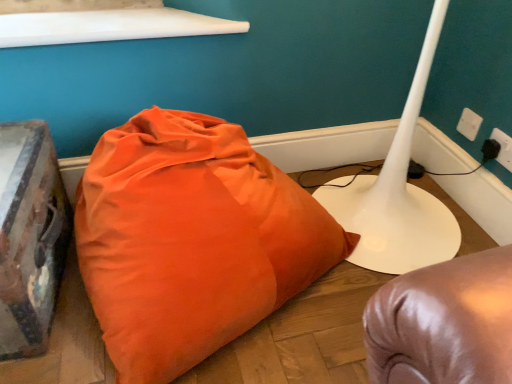
What do you see at coordinates (503, 148) in the screenshot? This screenshot has width=512, height=384. I see `white plastic electric outlet at upper right, the first electric outlet when ordered from right to left` at bounding box center [503, 148].

What do you see at coordinates (469, 124) in the screenshot? I see `white plastic electric outlet at upper right, the first electric outlet viewed from the left` at bounding box center [469, 124].

Locate an element on the screen. The width and height of the screenshot is (512, 384). white plastic electric outlet at upper right, acting as the 2th electric outlet starting from the top is located at coordinates (503, 148).

Is point (496, 157) more distant than point (425, 81)?

Yes, it is.

Can you see white plastic electric outlet at upper right, which is the 1th electric outlet in front-to-back order, touching white glossy table lamp at lower right?

No, white plastic electric outlet at upper right, which is the 1th electric outlet in front-to-back order, is not making contact with white glossy table lamp at lower right.

Considering the relative positions of white plastic electric outlet at upper right, the second electric outlet in the left-to-right sequence, and white glossy table lamp at lower right in the image provided, is white plastic electric outlet at upper right, the second electric outlet in the left-to-right sequence, to the left or to the right of white glossy table lamp at lower right?

white plastic electric outlet at upper right, the second electric outlet in the left-to-right sequence, is to the right of white glossy table lamp at lower right.

From a real-world perspective, is orange fabric pillow at center positioned above or below white glossy table lamp at lower right?

From a real-world perspective, orange fabric pillow at center is physically below white glossy table lamp at lower right.

From the image's perspective, is orange fabric pillow at center located above or below white glossy table lamp at lower right?

Clearly, from the image's perspective, orange fabric pillow at center is below white glossy table lamp at lower right.

Is orange fabric pillow at center taller or shorter than white glossy table lamp at lower right?

Considering their sizes, orange fabric pillow at center has less height than white glossy table lamp at lower right.

Is orange fabric pillow at center to the left of white glossy table lamp at lower right from the viewer's perspective?

Yes.

Considering the sizes of objects black plastic plug at lower right and white glossy table lamp at lower right in the image provided, who is smaller, black plastic plug at lower right or white glossy table lamp at lower right?

black plastic plug at lower right.

Is point (489, 150) behind point (430, 214)?

No, it is in front of (430, 214).

Is black plastic plug at lower right taller or shorter than white glossy table lamp at lower right?

Considering their sizes, black plastic plug at lower right has less height than white glossy table lamp at lower right.

Is white plastic electric outlet at upper right, the 1th electric outlet when ordered from back to front, bigger than white glossy table lamp at lower right?

No, white plastic electric outlet at upper right, the 1th electric outlet when ordered from back to front, is not bigger than white glossy table lamp at lower right.

In terms of height, does white plastic electric outlet at upper right, marked as the first electric outlet in a top-to-bottom arrangement, look taller or shorter compared to white glossy table lamp at lower right?

Clearly, white plastic electric outlet at upper right, marked as the first electric outlet in a top-to-bottom arrangement, is shorter compared to white glossy table lamp at lower right.

Which is closer, (470, 113) or (351, 259)?

Clearly, point (470, 113) is more distant from the camera than point (351, 259).

From a real-world perspective, is white plastic electric outlet at upper right, the 1th electric outlet when ordered from back to front, on white glossy table lamp at lower right?

Incorrect, from a real-world perspective, white plastic electric outlet at upper right, the 1th electric outlet when ordered from back to front, is lower than white glossy table lamp at lower right.

Which point is more forward, [398,130] or [150,244]?

The point [150,244] is closer.

From a real-world perspective, is white glossy table lamp at lower right located higher than orange fabric pillow at center?

Correct, in the physical world, white glossy table lamp at lower right is higher than orange fabric pillow at center.

Relative to orange fabric pillow at center, is white glossy table lamp at lower right in front or behind?

In the image, white glossy table lamp at lower right appears behind orange fabric pillow at center.

Choose the correct answer: Is white plastic electric outlet at upper right, which is the 1th electric outlet in front-to-back order, inside black plastic plug at lower right or outside it?

white plastic electric outlet at upper right, which is the 1th electric outlet in front-to-back order, is not enclosed by black plastic plug at lower right.

In the scene shown: Can you confirm if white plastic electric outlet at upper right, the second electric outlet in the left-to-right sequence, is positioned to the right of black plastic plug at lower right?

Indeed, white plastic electric outlet at upper right, the second electric outlet in the left-to-right sequence, is positioned on the right side of black plastic plug at lower right.

Is white plastic electric outlet at upper right, acting as the 1th electric outlet starting from the bottom, aimed at black plastic plug at lower right?

Yes.

Can you confirm if white plastic electric outlet at upper right, the first electric outlet when ordered from right to left, is taller than black plastic plug at lower right?

Yes, white plastic electric outlet at upper right, the first electric outlet when ordered from right to left, is taller than black plastic plug at lower right.

Considering the relative positions of white plastic electric outlet at upper right, acting as the 2th electric outlet starting from the top, and white plastic electric outlet at upper right, marked as the first electric outlet in a top-to-bottom arrangement, in the image provided, is white plastic electric outlet at upper right, acting as the 2th electric outlet starting from the top, to the right of white plastic electric outlet at upper right, marked as the first electric outlet in a top-to-bottom arrangement, from the viewer's perspective?

Yes.

From a real-world perspective, which object stands above the other?

In real-world perspective, white plastic electric outlet at upper right, which is the 2th electric outlet in front-to-back order, is above.

Is white plastic electric outlet at upper right, acting as the 1th electric outlet starting from the bottom, not inside white plastic electric outlet at upper right, which is counted as the second electric outlet, starting from the right?

That's correct, white plastic electric outlet at upper right, acting as the 1th electric outlet starting from the bottom, is outside of white plastic electric outlet at upper right, which is counted as the second electric outlet, starting from the right.

Is white plastic electric outlet at upper right, which is the 1th electric outlet in front-to-back order, taller than white plastic electric outlet at upper right, which is counted as the second electric outlet, starting from the right?

Yes, white plastic electric outlet at upper right, which is the 1th electric outlet in front-to-back order, is taller than white plastic electric outlet at upper right, which is counted as the second electric outlet, starting from the right.

Locate an element on the screen. table lamp on the left of white plastic electric outlet at upper right, the second electric outlet in the left-to-right sequence is located at coordinates (397, 193).

Locate an element on the screen. This screenshot has height=384, width=512. table lamp located on the right of orange fabric pillow at center is located at coordinates (397, 193).

From the image, which object appears to be nearer to white glossy table lamp at lower right, white plastic electric outlet at upper right, acting as the 1th electric outlet starting from the bottom, or black plastic plug at lower right?

black plastic plug at lower right is positioned closer to the anchor white glossy table lamp at lower right.

Estimate the real-world distances between objects in this image. Which object is closer to orange fabric pillow at center, white plastic electric outlet at upper right, which is the 2th electric outlet from bottom to top, or white glossy table lamp at lower right?

Based on the image, white glossy table lamp at lower right appears to be nearer to orange fabric pillow at center.

Estimate the real-world distances between objects in this image. Which object is closer to black plastic plug at lower right, white plastic electric outlet at upper right, which appears as the 2th electric outlet when viewed from the back, or orange fabric pillow at center?

The object closer to black plastic plug at lower right is white plastic electric outlet at upper right, which appears as the 2th electric outlet when viewed from the back.

Looking at the image, which one is located closer to black plastic plug at lower right, white plastic electric outlet at upper right, the second electric outlet in the left-to-right sequence, or white glossy table lamp at lower right?

Based on the image, white plastic electric outlet at upper right, the second electric outlet in the left-to-right sequence, appears to be nearer to black plastic plug at lower right.

Estimate the real-world distances between objects in this image. Which object is further from orange fabric pillow at center, white plastic electric outlet at upper right, which is the 2th electric outlet in front-to-back order, or white plastic electric outlet at upper right, the second electric outlet in the left-to-right sequence?

white plastic electric outlet at upper right, which is the 2th electric outlet in front-to-back order, lies further to orange fabric pillow at center than the other object.

From the image, which object appears to be farther from white plastic electric outlet at upper right, the first electric outlet viewed from the left, white plastic electric outlet at upper right, acting as the 1th electric outlet starting from the bottom, or orange fabric pillow at center?

orange fabric pillow at center.

Based on their spatial positions, is white plastic electric outlet at upper right, which appears as the 2th electric outlet when viewed from the back, or white glossy table lamp at lower right closer to orange fabric pillow at center?

The object closer to orange fabric pillow at center is white glossy table lamp at lower right.

When comparing their distances from orange fabric pillow at center, does white plastic electric outlet at upper right, the first electric outlet when ordered from right to left, or white plastic electric outlet at upper right, which is the 2th electric outlet in front-to-back order, seem further?

The object further to orange fabric pillow at center is white plastic electric outlet at upper right, which is the 2th electric outlet in front-to-back order.

Find the location of a particular element. table lamp situated between orange fabric pillow at center and white plastic electric outlet at upper right, the first electric outlet when ordered from right to left, from left to right is located at coordinates (397, 193).

Where is `plug between white plastic electric outlet at upper right, acting as the 2th electric outlet starting from the top, and white plastic electric outlet at upper right, the 1th electric outlet when ordered from back to front, from front to back`? plug between white plastic electric outlet at upper right, acting as the 2th electric outlet starting from the top, and white plastic electric outlet at upper right, the 1th electric outlet when ordered from back to front, from front to back is located at coordinates (490, 150).

The width and height of the screenshot is (512, 384). I want to click on plug between orange fabric pillow at center and white plastic electric outlet at upper right, the first electric outlet when ordered from right to left, from left to right, so click(x=490, y=150).

Where is `electric outlet between white glossy table lamp at lower right and white plastic electric outlet at upper right, the first electric outlet viewed from the left, in the front-back direction`? electric outlet between white glossy table lamp at lower right and white plastic electric outlet at upper right, the first electric outlet viewed from the left, in the front-back direction is located at coordinates (503, 148).